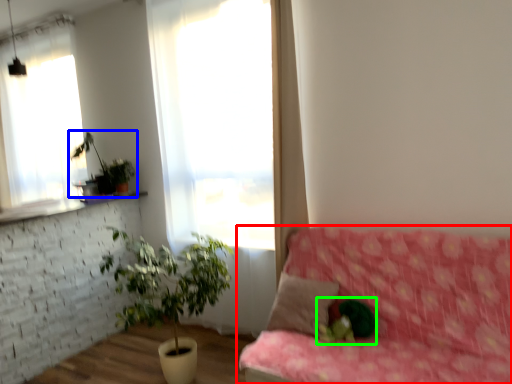
Question: Estimate the real-world distances between objects in this image. Which object is farther from studio couch (highlighted by a red box), houseplant (highlighted by a blue box) or plant (highlighted by a green box)?

Choices:
 (A) houseplant
 (B) plant

Answer: (A)